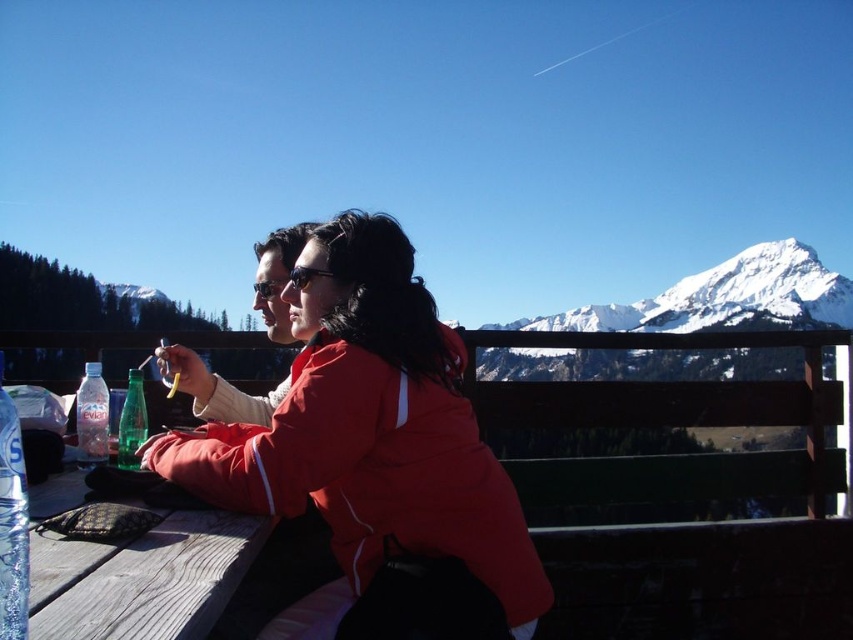
You are planning to take a photo of the snowy white mountain at upper right and the clear plastic bottle at lower left. Which object should you focus on first if you want to capture both in a single frame without moving the camera?

The snowy white mountain at upper right should be focused on first since it is taller than the clear plastic bottle at lower left, ensuring it fits within the frame when positioned properly.

You are standing in front of the table in the scene. There are two points marked on the table surface. The first point is at coordinates point (167, 564) and the second point is at point (119, 467). If you want to place a small object on the table closer to you, which point should you choose?

You should choose point (167, 564) because it is closer to the viewer than point (119, 467).

You are standing at the edge of the wooden table at lower left and want to place a small item at the exact location of point (143,579). Is this point on the table or off the table?

The point (143,579) is on the wooden table at lower left, so you can place the item there safely.